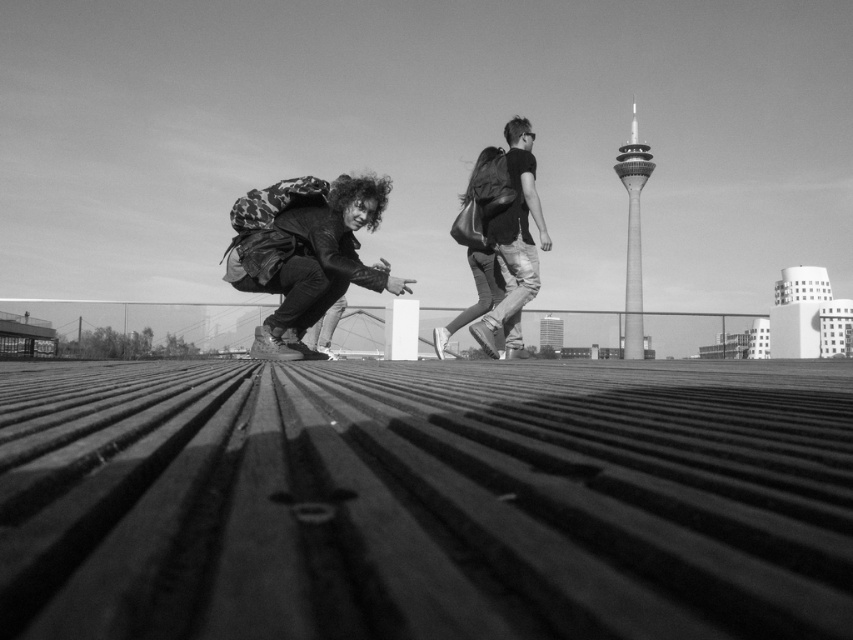
Question: Does camouflage backpack at center appear on the right side of smooth metallic tower at upper right?

Choices:
 (A) no
 (B) yes

Answer: (A)

Question: Which point appears farthest from the camera in this image?

Choices:
 (A) (627, 308)
 (B) (512, 147)
 (C) (300, 276)

Answer: (A)

Question: Is smooth metallic tower at upper right thinner than leather backpack at center?

Choices:
 (A) yes
 (B) no

Answer: (B)

Question: Which object is the closest to the leather backpack at center?

Choices:
 (A) camouflage backpack at center
 (B) matte black backpack at center
 (C) smooth metallic tower at upper right

Answer: (B)

Question: Is camouflage backpack at center closer to the viewer compared to leather backpack at center?

Choices:
 (A) yes
 (B) no

Answer: (A)

Question: Which of the following is the closest to the observer?

Choices:
 (A) (631, 205)
 (B) (503, 307)

Answer: (B)